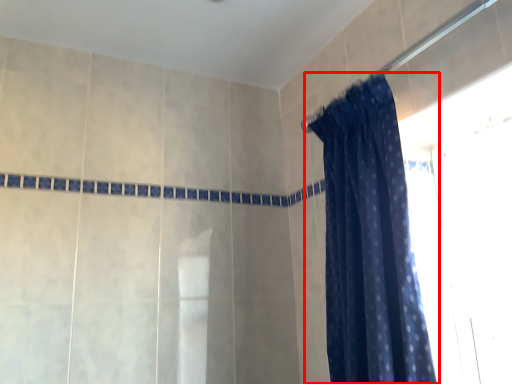
Question: In this image, where is curtain (annotated by the red box) located relative to shower?

Choices:
 (A) right
 (B) left

Answer: (B)